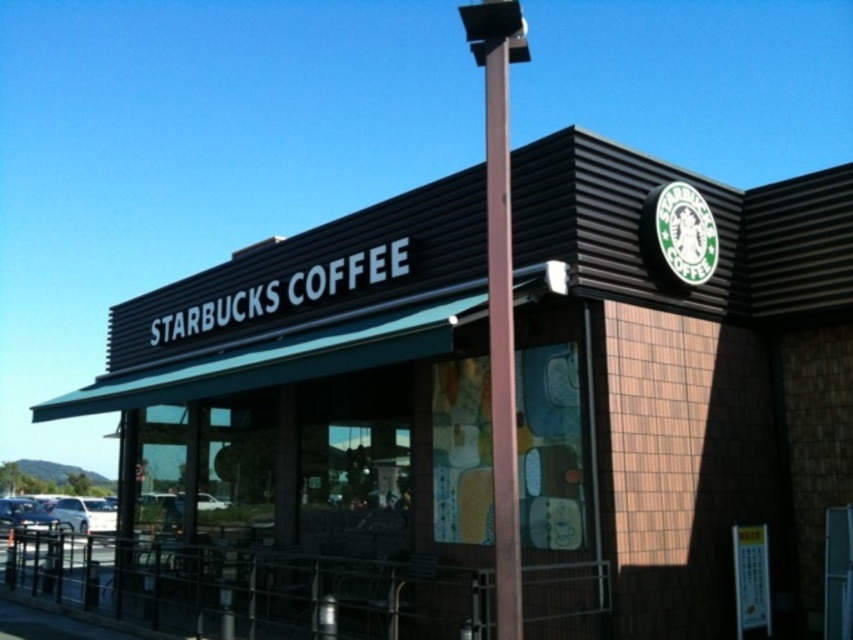
Question: Which point appears farthest from the camera in this image?

Choices:
 (A) [x=509, y=243]
 (B) [x=10, y=522]

Answer: (B)

Question: Does brown wood pole at center have a lesser width compared to white matte car at lower left?

Choices:
 (A) yes
 (B) no

Answer: (A)

Question: Can you confirm if brown wood pole at center is positioned to the left of metallic silver car at lower left?

Choices:
 (A) yes
 (B) no

Answer: (B)

Question: Considering the relative positions of brown wood pole at center and metallic silver car at lower left in the image provided, where is brown wood pole at center located with respect to metallic silver car at lower left?

Choices:
 (A) below
 (B) above

Answer: (B)

Question: Which object is the farthest from the brown wood pole at center?

Choices:
 (A) white matte car at lower left
 (B) metallic silver car at lower left

Answer: (A)

Question: Which point is closer to the camera taking this photo?

Choices:
 (A) (476, 10)
 (B) (47, 516)

Answer: (A)